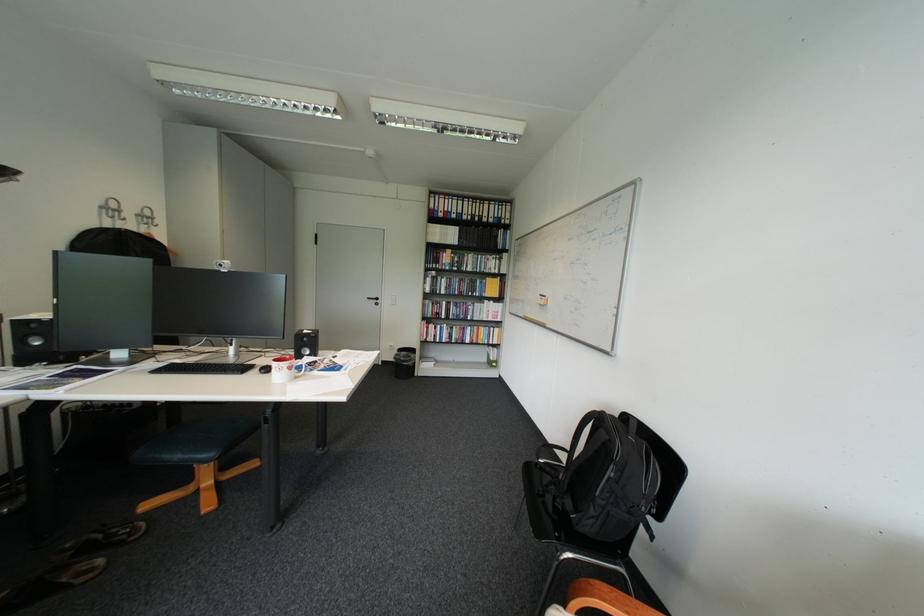
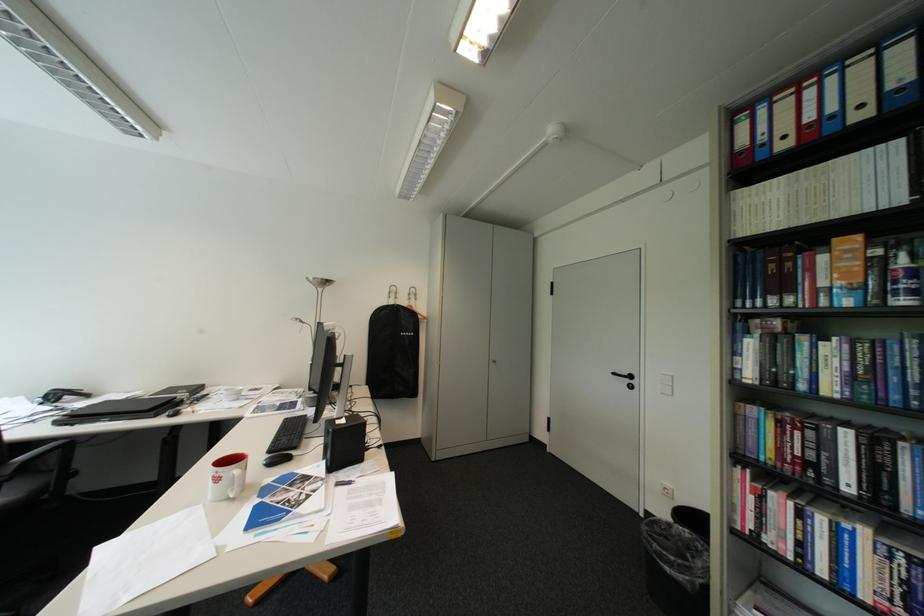
Locate, in the second image, the point that corresponds to point 467,265 in the first image.

(907, 284)